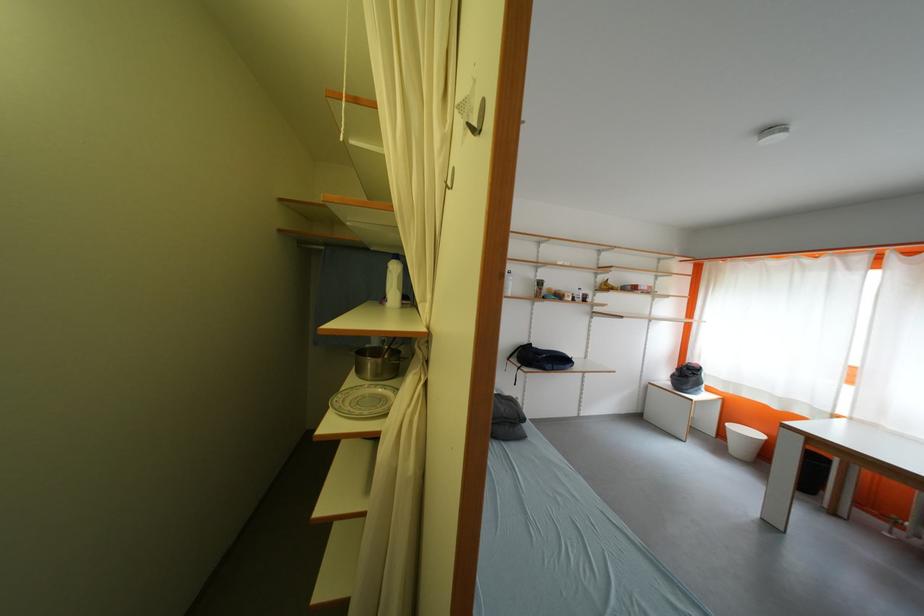
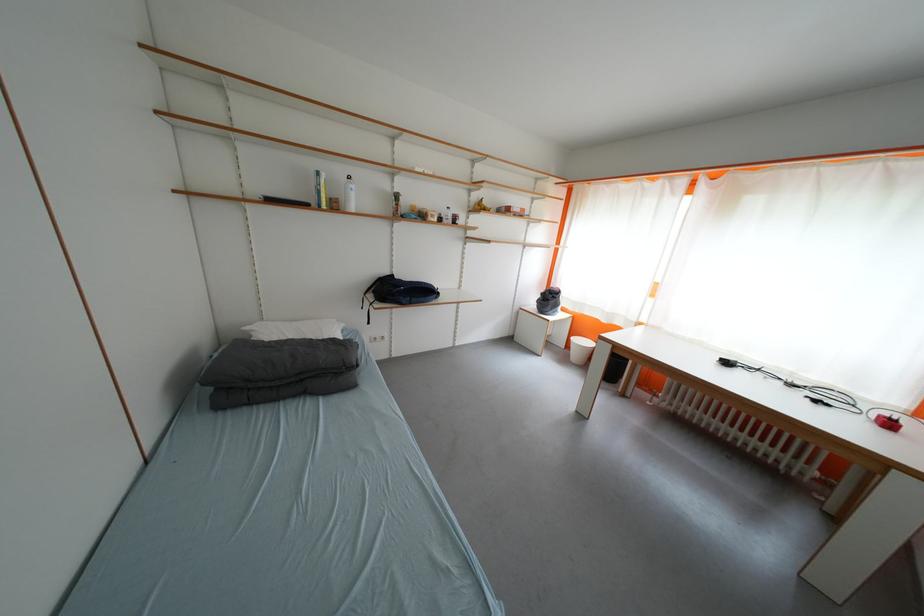
Locate, in the second image, the point that corresponds to point 687,373 in the first image.

(551, 297)